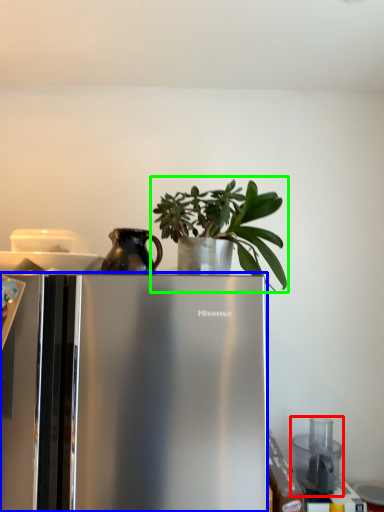
Question: Estimate the real-world distances between objects in this image. Which object is closer to appliance (highlighted by a red box), refrigerator (highlighted by a blue box) or houseplant (highlighted by a green box)?

Choices:
 (A) refrigerator
 (B) houseplant

Answer: (B)